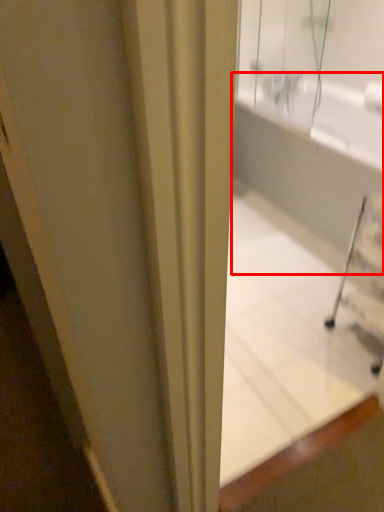
Question: From the image's perspective, considering the relative positions of bath (annotated by the red box) and bathtub in the image provided, where is bath (annotated by the red box) located with respect to the staircase?

Choices:
 (A) below
 (B) above

Answer: (B)